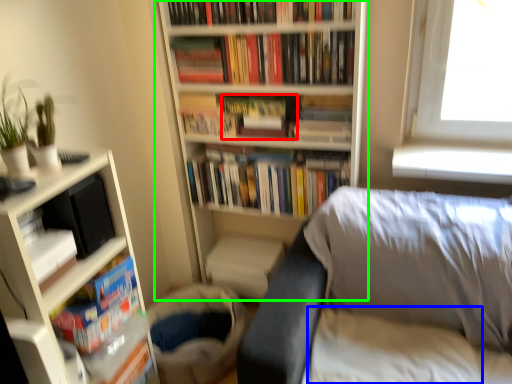
Question: Considering the real-world distances, which object is farthest from paperback book (highlighted by a red box)? sheet (highlighted by a blue box) or bookcase (highlighted by a green box)?

Choices:
 (A) sheet
 (B) bookcase

Answer: (A)